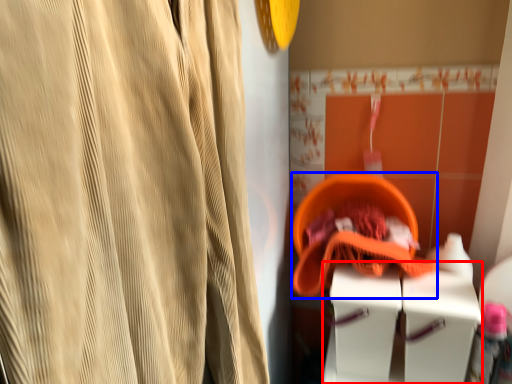
Question: Which point is further to the camera, vanity (highlighted by a red box) or basket (highlighted by a blue box)?

Choices:
 (A) vanity
 (B) basket

Answer: (B)